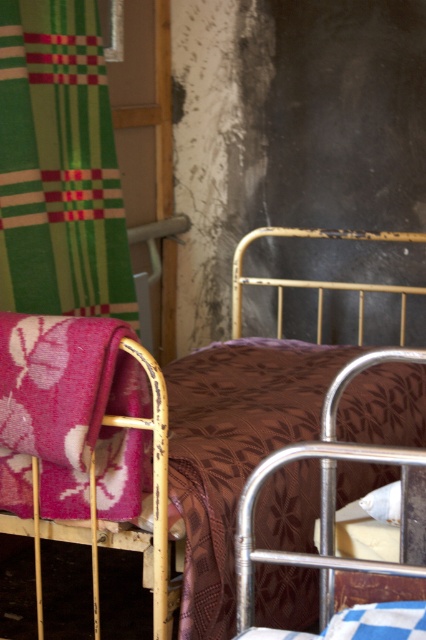
From the picture: You are organizing a small event in the room and need to decide which fabric to use for decorations. The brown floral fabric at center and the floral pink fabric at left are available. Which fabric has a greater width?

The brown floral fabric at center has a greater width than the floral pink fabric at left as stated in the description.

You are standing in the room and want to reach the brown floral fabric at center. If your arm can extend 5 feet, can you reach it?

The brown floral fabric at center is 6.04 feet away from camera, so your arm cannot reach it since it can only extend 5 feet.

You are standing in the room and want to reach the green striped fabric at upper left. If your arm can extend 2 meters, can you touch it without moving your feet?

The green striped fabric at upper left is 7.45 feet away from the viewer. Since 7.45 feet is approximately 2.27 meters, which is longer than your arm extension of 2 meters, you cannot touch it without moving your feet.